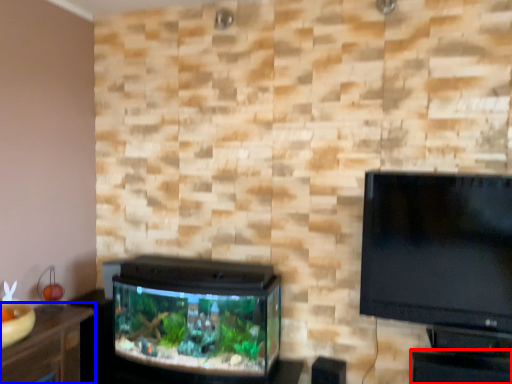
Question: Among these objects, which one is farthest to the camera, table (highlighted by a red box) or furniture (highlighted by a blue box)?

Choices:
 (A) table
 (B) furniture

Answer: (A)